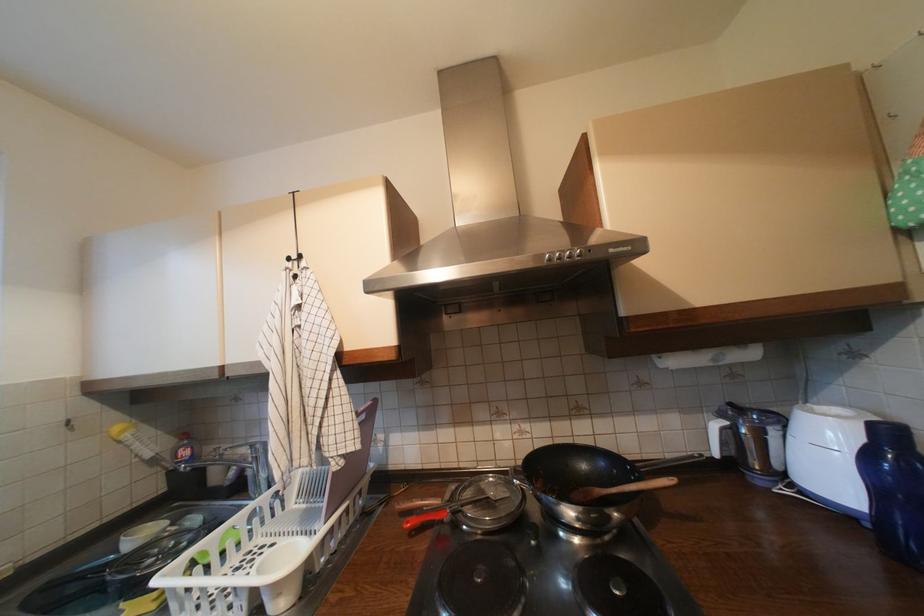
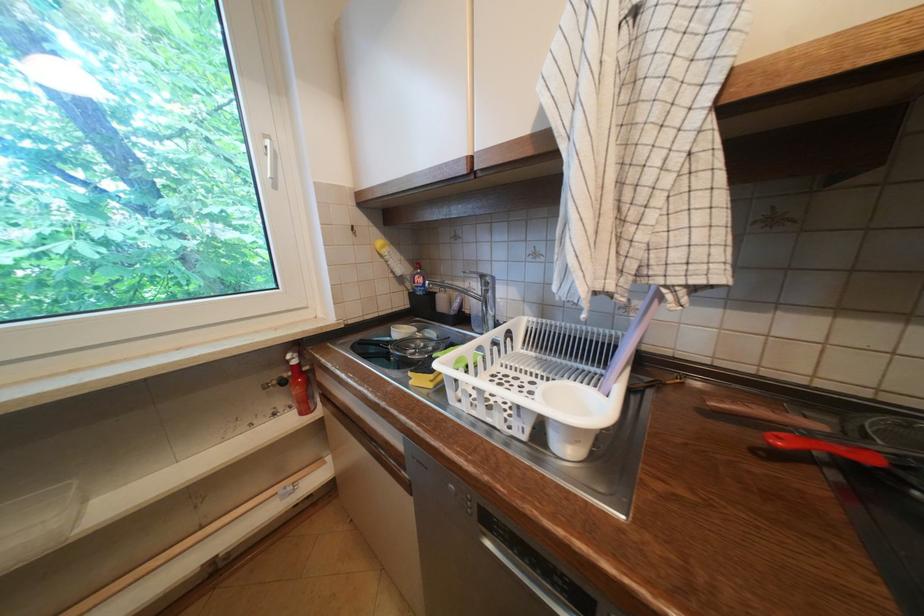
Based on the continuous images, in which direction is the camera rotating?

The rotation direction of the camera is left-down.